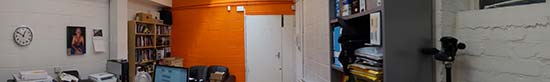
Locate an element on the screen. The height and width of the screenshot is (82, 550). door is located at coordinates (273, 58).